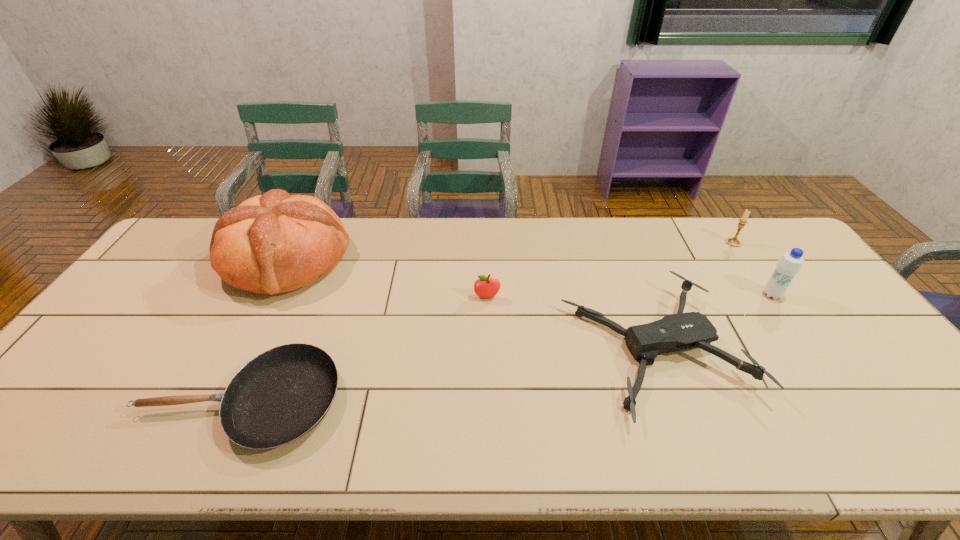
Locate an element on the screen. This screenshot has height=540, width=960. unoccupied area between the fourth tallest object and the candle holder is located at coordinates (611, 270).

Locate an element on the screen. This screenshot has height=540, width=960. free space between the tallest object and the candle holder is located at coordinates (510, 251).

Where is `free space that is in between the shortest object and the bread`? free space that is in between the shortest object and the bread is located at coordinates (264, 330).

Where is `empty space between the bread and the fourth shortest object`? The height and width of the screenshot is (540, 960). empty space between the bread and the fourth shortest object is located at coordinates (510, 251).

Where is `free spot between the frying pan and the second shortest object`? The image size is (960, 540). free spot between the frying pan and the second shortest object is located at coordinates (447, 375).

Identify the location of vacant space that's between the bread and the drone. (470, 305).

Find the location of a particular element. This screenshot has width=960, height=540. the fifth closest object to the third object from right to left is located at coordinates (273, 243).

Identify the location of object that stands as the third closest to the fifth tallest object. This screenshot has width=960, height=540. (734, 242).

At what (x,y) coordinates should I click in order to perform the action: click on vacant point that satisfies the following two spatial constraints: 1. on the back side of the water bottle; 2. on the left side of the shortest object. Please return your answer as a coordinate pair (x, y). Looking at the image, I should click on (289, 295).

Where is `vacant position in the image that satisfies the following two spatial constraints: 1. on the front side of the shortest object; 2. on the left side of the bread`? vacant position in the image that satisfies the following two spatial constraints: 1. on the front side of the shortest object; 2. on the left side of the bread is located at coordinates (215, 401).